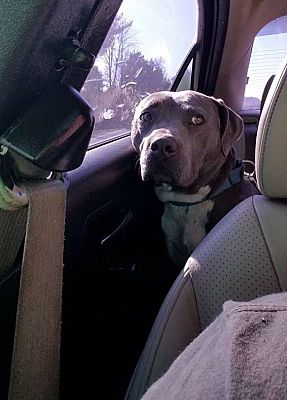
This screenshot has width=287, height=400. I want to click on towel, so click(x=248, y=326).